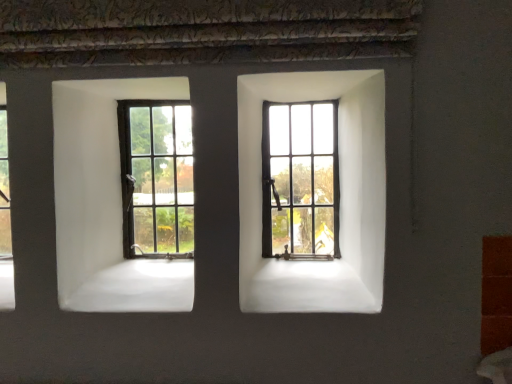
Image resolution: width=512 pixels, height=384 pixels. What are the coordinates of `matte black window at center left, arranged as the 2th window when viewed from the right` in the screenshot? It's located at (157, 178).

Describe the element at coordinates (157, 178) in the screenshot. This screenshot has height=384, width=512. I see `matte black window at center left, arranged as the 2th window when viewed from the right` at that location.

The width and height of the screenshot is (512, 384). What do you see at coordinates (300, 179) in the screenshot? I see `matte black window at center, placed as the 2th window when sorted from left to right` at bounding box center [300, 179].

Identify the location of matte black window at center, placed as the 2th window when sorted from left to right. (300, 179).

At what (x,y) coordinates should I click in order to perform the action: click on matte black window at center left, which is the first window in left-to-right order. Please return your answer as a coordinate pair (x, y). The height and width of the screenshot is (384, 512). Looking at the image, I should click on (157, 178).

Which object is positioned more to the right, matte black window at center left, which is the first window in left-to-right order, or matte black window at center, placed as the 2th window when sorted from left to right?

From the viewer's perspective, matte black window at center, placed as the 2th window when sorted from left to right, appears more on the right side.

Which is in front, matte black window at center left, which is the first window in left-to-right order, or matte black window at center, placed as the 2th window when sorted from left to right?

matte black window at center, placed as the 2th window when sorted from left to right.

Does point (146, 105) appear closer or farther from the camera than point (316, 185)?

Point (146, 105) is farther from the camera than point (316, 185).

From the image's perspective, which is below, matte black window at center left, arranged as the 2th window when viewed from the right, or matte black window at center, the 1th window in the right-to-left sequence?

matte black window at center left, arranged as the 2th window when viewed from the right.

From the picture: From a real-world perspective, is matte black window at center left, arranged as the 2th window when viewed from the right, on matte black window at center, placed as the 2th window when sorted from left to right?

Yes, from a real-world perspective, matte black window at center left, arranged as the 2th window when viewed from the right, is over matte black window at center, placed as the 2th window when sorted from left to right

Does matte black window at center left, which is the first window in left-to-right order, have a lesser width compared to matte black window at center, the 1th window in the right-to-left sequence?

No, matte black window at center left, which is the first window in left-to-right order, is not thinner than matte black window at center, the 1th window in the right-to-left sequence.

Is matte black window at center left, arranged as the 2th window when viewed from the right, shorter than matte black window at center, the 1th window in the right-to-left sequence?

In fact, matte black window at center left, arranged as the 2th window when viewed from the right, may be taller than matte black window at center, the 1th window in the right-to-left sequence.

Considering the relative sizes of matte black window at center left, which is the first window in left-to-right order, and matte black window at center, the 1th window in the right-to-left sequence, in the image provided, is matte black window at center left, which is the first window in left-to-right order, bigger than matte black window at center, the 1th window in the right-to-left sequence,?

Indeed, matte black window at center left, which is the first window in left-to-right order, has a larger size compared to matte black window at center, the 1th window in the right-to-left sequence.

Is matte black window at center left, arranged as the 2th window when viewed from the right, located outside matte black window at center, placed as the 2th window when sorted from left to right?

matte black window at center left, arranged as the 2th window when viewed from the right, lies outside matte black window at center, placed as the 2th window when sorted from left to right,'s area.

In the scene shown: Is matte black window at center left, which is the first window in left-to-right order, touching matte black window at center, placed as the 2th window when sorted from left to right?

matte black window at center left, which is the first window in left-to-right order, and matte black window at center, placed as the 2th window when sorted from left to right, are not in contact.

Could you tell me if matte black window at center left, arranged as the 2th window when viewed from the right, is facing matte black window at center, placed as the 2th window when sorted from left to right?

No, matte black window at center left, arranged as the 2th window when viewed from the right, is not turned towards matte black window at center, placed as the 2th window when sorted from left to right.

Can you tell me how much matte black window at center left, which is the first window in left-to-right order, and matte black window at center, the 1th window in the right-to-left sequence, differ in facing direction?

0.805 degrees separate the facing orientations of matte black window at center left, which is the first window in left-to-right order, and matte black window at center, the 1th window in the right-to-left sequence.

Locate an element on the screen. The height and width of the screenshot is (384, 512). window that is on the right side of matte black window at center left, which is the first window in left-to-right order is located at coordinates (300, 179).

Can you confirm if matte black window at center, the 1th window in the right-to-left sequence, is positioned to the right of matte black window at center left, arranged as the 2th window when viewed from the right?

Yes.

In the image, is matte black window at center, placed as the 2th window when sorted from left to right, positioned in front of or behind matte black window at center left, which is the first window in left-to-right order?

Clearly, matte black window at center, placed as the 2th window when sorted from left to right, is in front of matte black window at center left, which is the first window in left-to-right order.

Between point (289, 135) and point (125, 243), which one is positioned in front?

Positioned in front is point (289, 135).

From the image's perspective, does matte black window at center, placed as the 2th window when sorted from left to right, appear lower than matte black window at center left, which is the first window in left-to-right order?

Actually, matte black window at center, placed as the 2th window when sorted from left to right, appears above matte black window at center left, which is the first window in left-to-right order, in the image.

From a real-world perspective, is matte black window at center, the 1th window in the right-to-left sequence, physically located above or below matte black window at center left, arranged as the 2th window when viewed from the right?

matte black window at center, the 1th window in the right-to-left sequence, is situated lower than matte black window at center left, arranged as the 2th window when viewed from the right, in the real world.

Considering the relative sizes of matte black window at center, the 1th window in the right-to-left sequence, and matte black window at center left, which is the first window in left-to-right order, in the image provided, is matte black window at center, the 1th window in the right-to-left sequence, wider than matte black window at center left, which is the first window in left-to-right order,?

No.

Does matte black window at center, placed as the 2th window when sorted from left to right, have a greater height compared to matte black window at center left, arranged as the 2th window when viewed from the right?

Incorrect, the height of matte black window at center, placed as the 2th window when sorted from left to right, is not larger of that of matte black window at center left, arranged as the 2th window when viewed from the right.

Can you confirm if matte black window at center, placed as the 2th window when sorted from left to right, is bigger than matte black window at center left, arranged as the 2th window when viewed from the right?

No.

Could matte black window at center left, which is the first window in left-to-right order, be considered to be inside matte black window at center, placed as the 2th window when sorted from left to right?

No, matte black window at center left, which is the first window in left-to-right order, is not inside matte black window at center, placed as the 2th window when sorted from left to right.

Is matte black window at center, the 1th window in the right-to-left sequence, not near matte black window at center left, which is the first window in left-to-right order?

Actually, matte black window at center, the 1th window in the right-to-left sequence, and matte black window at center left, which is the first window in left-to-right order, are a little close together.

Is matte black window at center, placed as the 2th window when sorted from left to right, facing towards matte black window at center left, arranged as the 2th window when viewed from the right?

No, matte black window at center, placed as the 2th window when sorted from left to right, is not turned towards matte black window at center left, arranged as the 2th window when viewed from the right.

Locate an element on the screen. window below the matte black window at center, the 1th window in the right-to-left sequence (from the image's perspective) is located at coordinates 157,178.

There is a matte black window at center, the 1th window in the right-to-left sequence. Where is `window above it (from a real-world perspective)`? The height and width of the screenshot is (384, 512). window above it (from a real-world perspective) is located at coordinates (157, 178).

At what (x,y) coordinates should I click in order to perform the action: click on window lying in front of the matte black window at center left, arranged as the 2th window when viewed from the right. Please return your answer as a coordinate pair (x, y). Image resolution: width=512 pixels, height=384 pixels. Looking at the image, I should click on (300, 179).